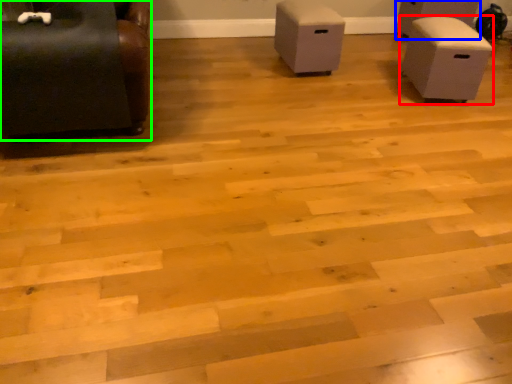
Question: Which is nearer to the furniture (highlighted by a red box)? furniture (highlighted by a blue box) or furniture (highlighted by a green box).

Choices:
 (A) furniture
 (B) furniture

Answer: (A)